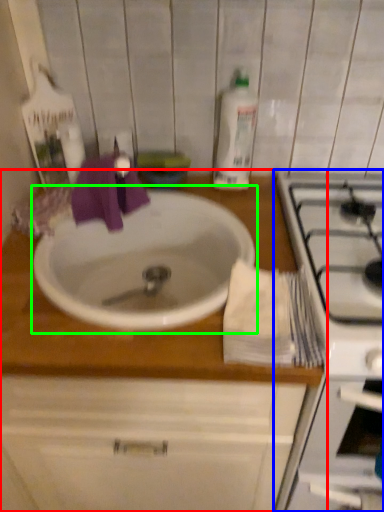
Question: Which object is the closest to the countertop (highlighted by a red box)? Choose among these: appliance (highlighted by a blue box) or sink (highlighted by a green box).

Choices:
 (A) appliance
 (B) sink

Answer: (B)